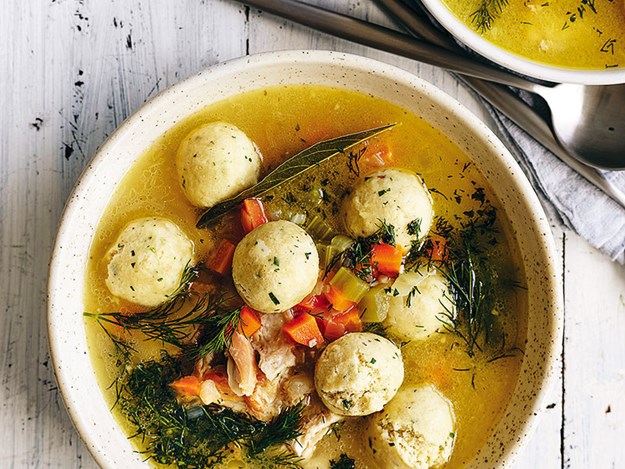
Locate an element on the screen. The height and width of the screenshot is (469, 625). tabletop is located at coordinates (609, 408), (532, 438), (29, 414).